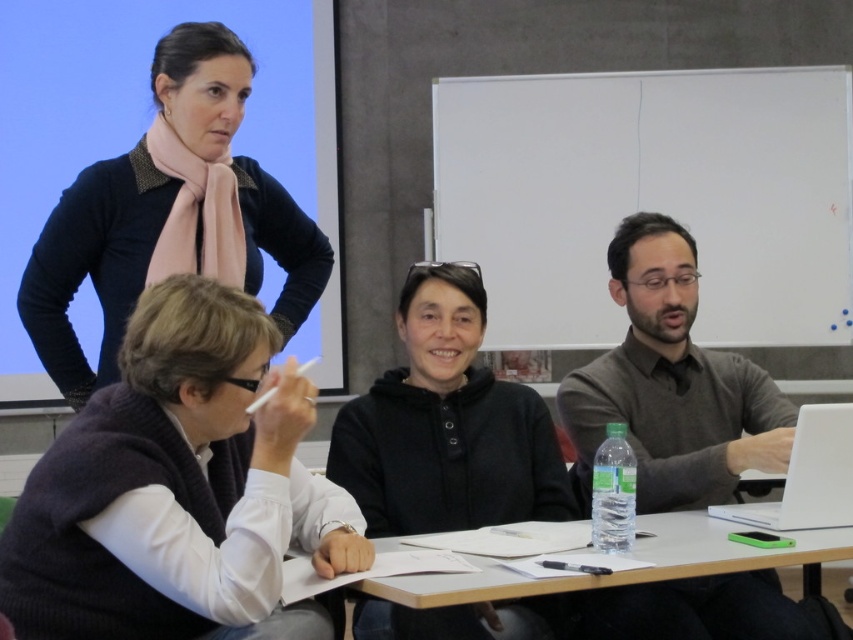
Who is more distant from viewer, (347, 545) or (846, 440)?

The point (846, 440) is more distant.

Is dark purple sweater at lower left wider than white plastic laptop at right?

Yes, dark purple sweater at lower left is wider than white plastic laptop at right.

Who is more distant from viewer, (317, 547) or (833, 419)?

The point (833, 419) is behind.

Locate an element on the screen. The width and height of the screenshot is (853, 640). dark purple sweater at lower left is located at coordinates (173, 484).

Which is behind, point (90, 419) or point (434, 592)?

Positioned behind is point (90, 419).

Which of these two, dark purple sweater at lower left or white plastic table at lower center, stands shorter?

With less height is white plastic table at lower center.

Find the location of a particular element. Image resolution: width=853 pixels, height=640 pixels. dark purple sweater at lower left is located at coordinates (173, 484).

Does matte gray sweater at center appear on the right side of matte black sweater at upper left?

Yes, matte gray sweater at center is to the right of matte black sweater at upper left.

Locate an element on the screen. matte gray sweater at center is located at coordinates (671, 385).

Between point (782, 632) and point (233, 61), which one is positioned behind?

The point (233, 61) is behind.

The width and height of the screenshot is (853, 640). I want to click on matte gray sweater at center, so click(671, 385).